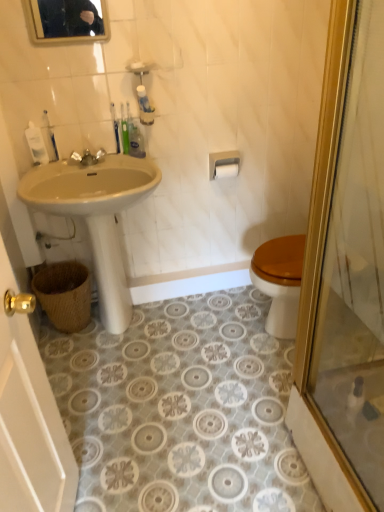
The width and height of the screenshot is (384, 512). I want to click on vacant space that is to the left of matte silver faucet at upper center, so click(x=47, y=169).